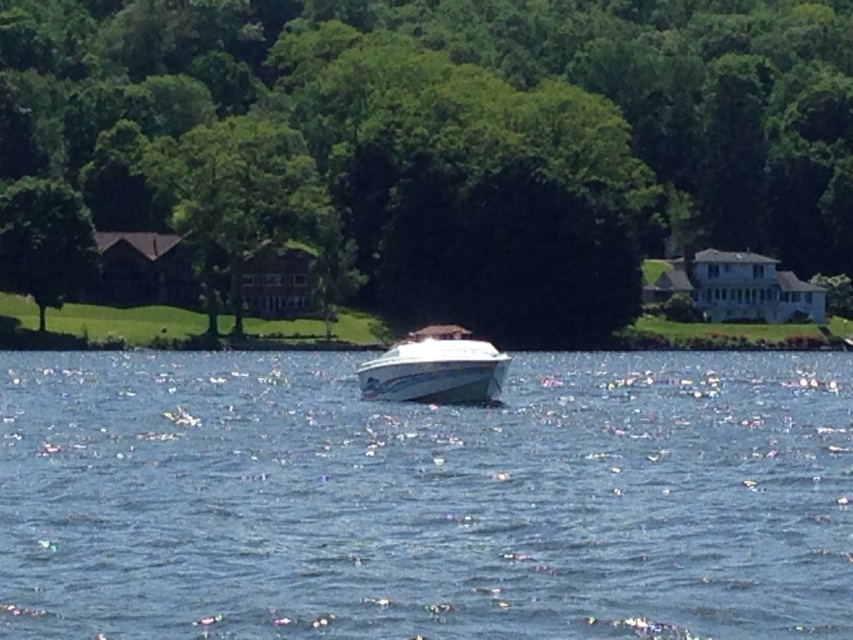
Is point (605, 241) closer to viewer compared to point (228, 218)?

That is False.

Is green leafy tree at center further to the viewer compared to green leafy tree at upper center?

No.

This screenshot has width=853, height=640. Describe the element at coordinates (450, 138) in the screenshot. I see `green leafy tree at center` at that location.

This screenshot has height=640, width=853. Find the location of `green leafy tree at center`. green leafy tree at center is located at coordinates (450, 138).

Does green leafy tree at upper center lie in front of green leafy tree at left?

No, it is not.

Which of these two, green leafy tree at upper center or green leafy tree at left, stands shorter?

green leafy tree at left is shorter.

Find the location of `green leafy tree at upper center`. green leafy tree at upper center is located at coordinates (236, 196).

Between blue water at center and green leafy tree at left, which one is positioned higher?

green leafy tree at left is above.

The width and height of the screenshot is (853, 640). What are the coordinates of `blue water at center` in the screenshot? It's located at (425, 499).